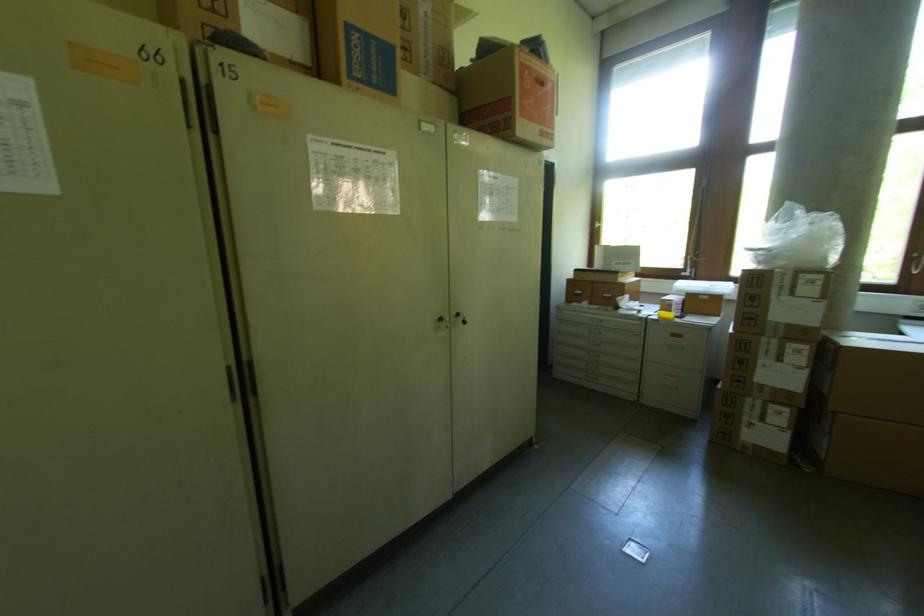
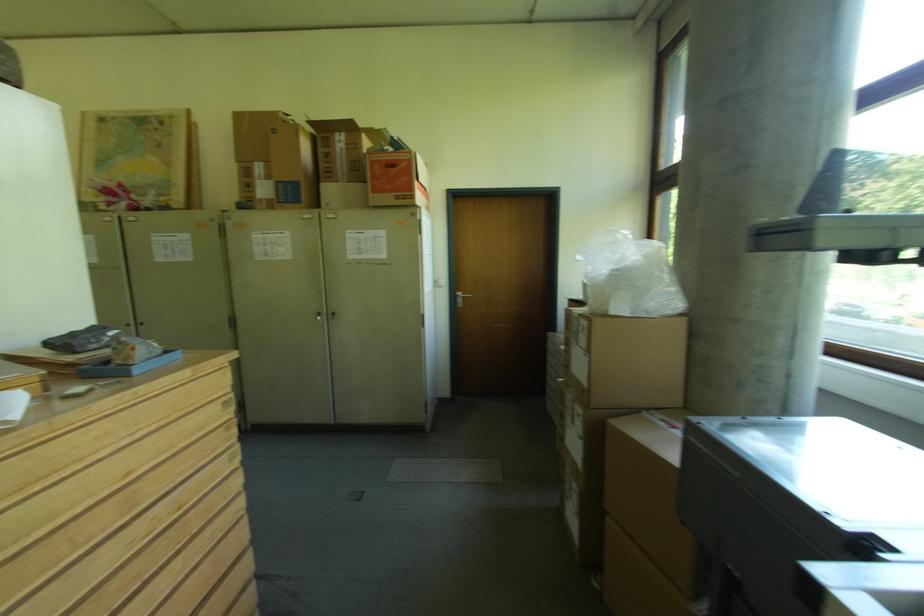
Find the pixel in the second image that matches the point at 370,38 in the first image.

(287, 185)